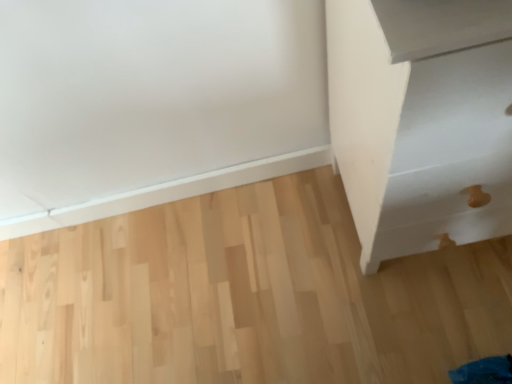
Locate an element on the screen. This screenshot has height=384, width=512. empty space that is ontop of natural wood floor at center (from a real-world perspective) is located at coordinates coord(233,294).